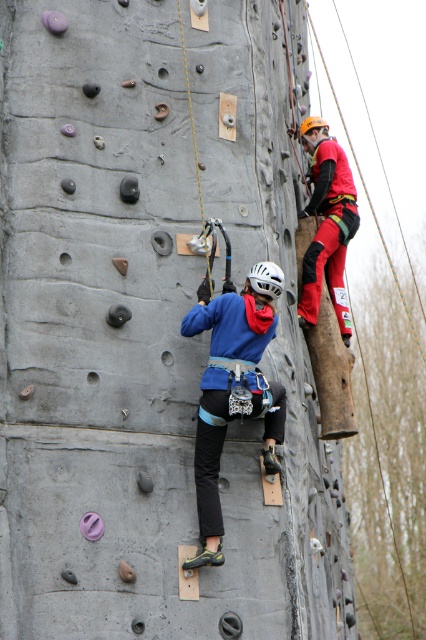
How distant is blue fabric climbing harness at center from orange matte helmet at upper center?

blue fabric climbing harness at center and orange matte helmet at upper center are 24.87 meters apart.

Locate an element on the screen. This screenshot has height=640, width=426. blue fabric climbing harness at center is located at coordinates (233, 388).

The width and height of the screenshot is (426, 640). I want to click on blue fabric climbing harness at center, so click(233, 388).

How distant is blue fabric climbing harness at center from white matte helmet at center?

blue fabric climbing harness at center is 10.55 feet away from white matte helmet at center.

Is point (204, 400) positioned before point (267, 289)?

That is True.

Is point (204, 468) positioned in front of point (276, 284)?

Yes, it is in front of point (276, 284).

Where is `blue fabric climbing harness at center`? The width and height of the screenshot is (426, 640). blue fabric climbing harness at center is located at coordinates (233, 388).

Is white matte helmet at center positioned before orange matte helmet at upper center?

Yes, it is.

Who is more distant from viewer, [281,273] or [319,120]?

The point [319,120] is more distant.

Identify the location of white matte helmet at center. (267, 278).

Find the location of a particular element. The image size is (426, 640). white matte helmet at center is located at coordinates (267, 278).